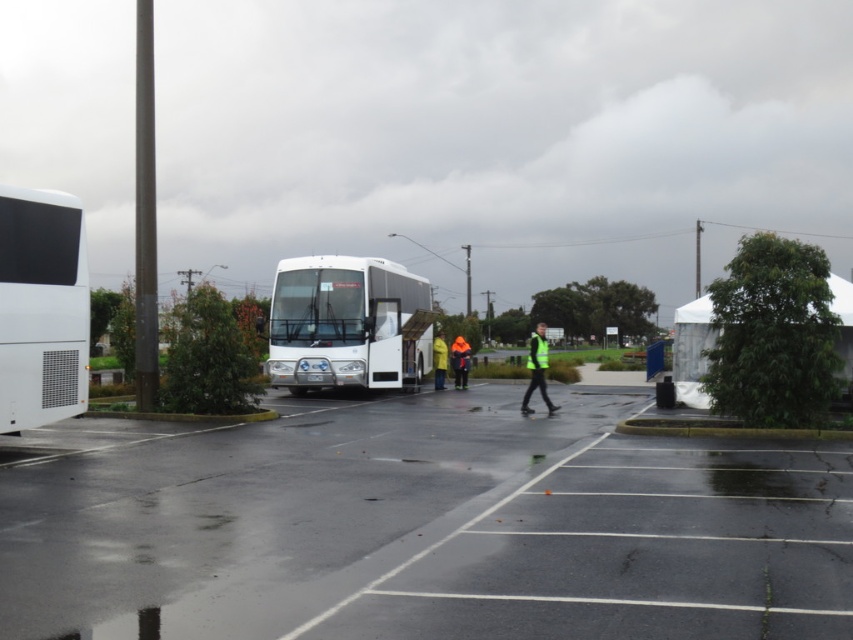
You are standing at the center of the image and want to walk towards the green leafy tree at right. According to the coordinates provided, in which direction should you move?

The green leafy tree at right is located at coordinates 0.523 on the x axis and 0.907 on the y axis. Since you are at the center, you should move towards the right and upwards to reach the tree.

You are standing at the camera position and want to throw a ball to a friend who is at point [434,352]. There is an obstacle at point [730,273]. Will the ball pass over or under the obstacle?

The obstacle at point [730,273] is closer to the camera than the friend at point [434,352]. Therefore, the ball will pass under the obstacle.

You are standing at the edge of the black asphalt parking lot at lower left and want to reach the white matte bus at center. Which direction should you move to get there?

Since the black asphalt parking lot at lower left is to the right of the white matte bus at center, you should move to your left to reach the bus.